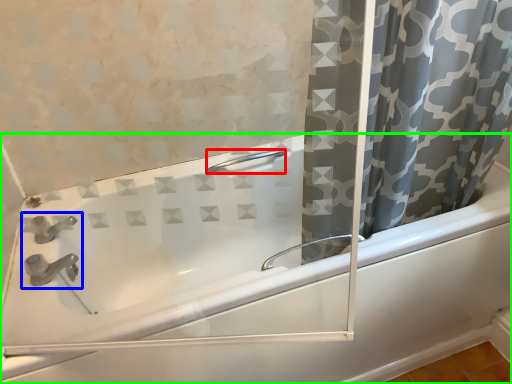
Question: Based on their relative distances, which object is farther from shower (highlighted by a red box)? Choose from sink (highlighted by a blue box) and bathtub (highlighted by a green box).

Choices:
 (A) sink
 (B) bathtub

Answer: (A)